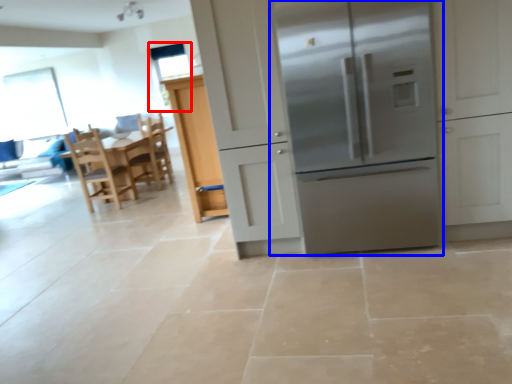
Question: Which of the following is the farthest to the observer, window screen (highlighted by a red box) or refrigerator (highlighted by a blue box)?

Choices:
 (A) window screen
 (B) refrigerator

Answer: (A)